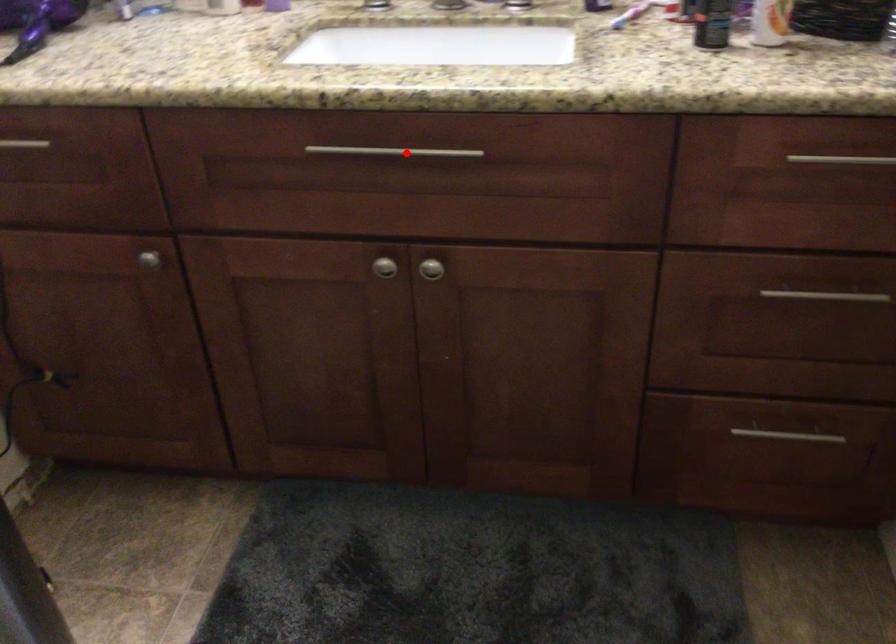
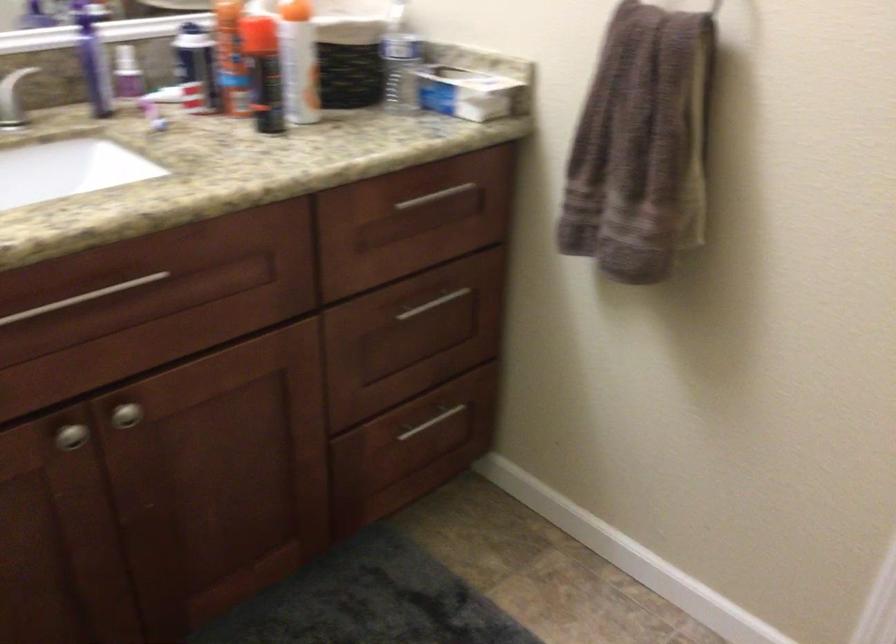
Locate, in the second image, the point that corresponds to the highlighted location in the first image.

(82, 298)